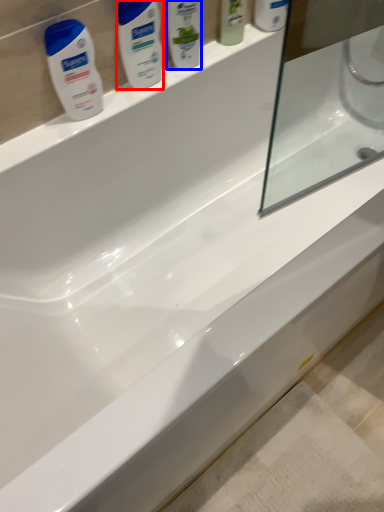
Question: Which object is closer to the camera taking this photo, personal care (highlighted by a red box) or cleaning product (highlighted by a blue box)?

Choices:
 (A) personal care
 (B) cleaning product

Answer: (A)